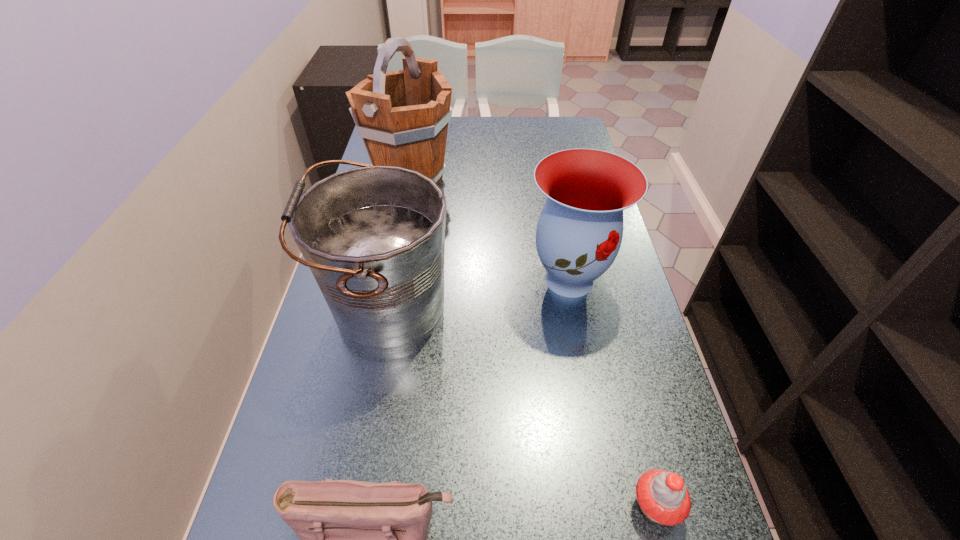
In order to click on cupcake that is at the right edge in this screenshot , I will do `click(662, 496)`.

Locate an element on the screen. blank space at the far edge of the desktop is located at coordinates (477, 137).

I want to click on free region at the right edge of the desktop, so click(x=632, y=438).

Where is `vacant point at the far right corner`? Image resolution: width=960 pixels, height=540 pixels. vacant point at the far right corner is located at coordinates pyautogui.click(x=570, y=124).

This screenshot has height=540, width=960. I want to click on free space that is in between the shorter bucket and the vase, so click(x=480, y=295).

The height and width of the screenshot is (540, 960). In order to click on empty space that is in between the cupcake and the nearer bucket in this screenshot , I will do `click(523, 408)`.

At what (x,y) coordinates should I click in order to perform the action: click on empty space between the taller bucket and the cupcake. Please return your answer as a coordinate pair (x, y). The width and height of the screenshot is (960, 540). Looking at the image, I should click on (533, 342).

Where is `free space between the vase and the tallest object`? This screenshot has height=540, width=960. free space between the vase and the tallest object is located at coordinates pyautogui.click(x=490, y=230).

Where is `free space that is in between the vase and the tallest object`? The height and width of the screenshot is (540, 960). free space that is in between the vase and the tallest object is located at coordinates (490, 230).

The width and height of the screenshot is (960, 540). What are the coordinates of `vacant area between the nearer bucket and the cupcake` in the screenshot? It's located at (523, 408).